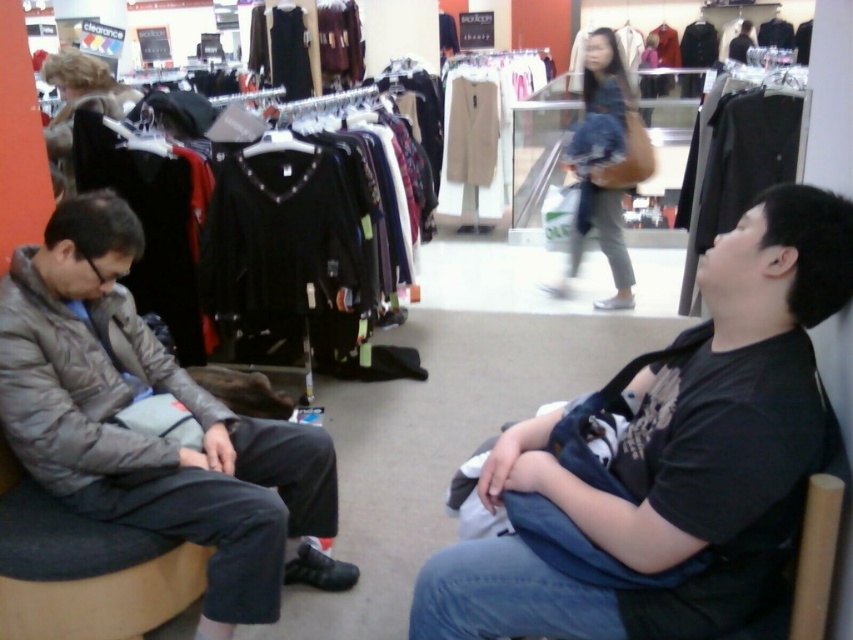
You are a store employee who needs to arrange the black cotton shirt at right and the gray quilted jacket at left on a hanger rack. The rack has a minimum spacing requirement of 30 inches between items. Can you place them on the rack without violating the spacing rule?

The black cotton shirt at right and gray quilted jacket at left are 34.43 inches apart, which exceeds the minimum spacing requirement of 30 inches. Therefore, they can be placed on the hanger rack without violating the spacing rule.

You are a store employee who needs to arrange the black cotton shirt at right and the gray quilted jacket at left on a mannequin. Which clothing item should be placed higher on the mannequin to ensure visibility?

The gray quilted jacket at left should be placed higher on the mannequin since it is taller than the black cotton shirt at right, ensuring better visibility.

From the picture: You are a store employee arranging items on a shelf. You have a black cotton shirt at right and a gray quilted jacket at left. Which item is positioned higher on the shelf?

The black cotton shirt at right is positioned higher on the shelf than the gray quilted jacket at left because it is above it.